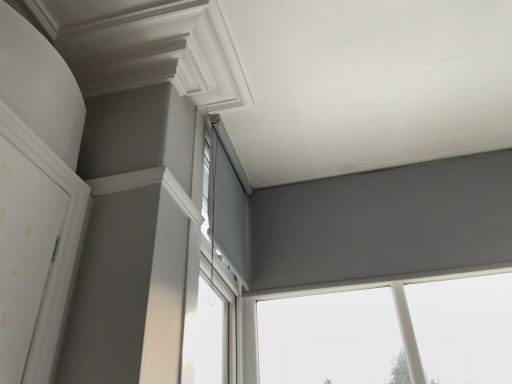
Question: Considering the relative positions of matte gray roller blind at center, acting as the 2th window starting from the right, and matte gray window at upper center, the third window positioned from the left, in the image provided, is matte gray roller blind at center, acting as the 2th window starting from the right, to the left of matte gray window at upper center, the third window positioned from the left, from the viewer's perspective?

Choices:
 (A) no
 (B) yes

Answer: (B)

Question: Is matte gray roller blind at center, acting as the 2th window starting from the right, wider than matte gray window at upper center, the third window positioned from the left?

Choices:
 (A) no
 (B) yes

Answer: (A)

Question: Is matte gray roller blind at center, the second window from the left, placed right next to matte gray window at upper center, placed as the first window when sorted from right to left?

Choices:
 (A) yes
 (B) no

Answer: (B)

Question: Is matte gray roller blind at center, acting as the 2th window starting from the right, bigger than matte gray window at upper center, placed as the first window when sorted from right to left?

Choices:
 (A) no
 (B) yes

Answer: (A)

Question: Does matte gray roller blind at center, the second window from the left, come behind matte gray window at upper center, the third window positioned from the left?

Choices:
 (A) no
 (B) yes

Answer: (A)

Question: Considering the relative sizes of matte gray roller blind at center, acting as the 2th window starting from the right, and matte gray window at upper center, the third window positioned from the left, in the image provided, is matte gray roller blind at center, acting as the 2th window starting from the right, shorter than matte gray window at upper center, the third window positioned from the left,?

Choices:
 (A) no
 (B) yes

Answer: (B)

Question: Can you confirm if matte gray window at upper center, placed as the first window when sorted from right to left, is shorter than matte gray roller blind at center, acting as the 2th window starting from the right?

Choices:
 (A) yes
 (B) no

Answer: (B)

Question: Is matte gray window at upper center, the third window positioned from the left, bigger than matte gray roller blind at center, the second window from the left?

Choices:
 (A) no
 (B) yes

Answer: (B)

Question: Is matte gray roller blind at center, the second window from the left, inside matte gray window at upper center, the third window positioned from the left?

Choices:
 (A) no
 (B) yes

Answer: (A)

Question: Is matte gray window at upper center, the third window positioned from the left, at the left side of matte gray roller blind at center, the second window from the left?

Choices:
 (A) yes
 (B) no

Answer: (B)

Question: Is matte gray window at upper center, placed as the first window when sorted from right to left, facing towards matte gray roller blind at center, the second window from the left?

Choices:
 (A) no
 (B) yes

Answer: (B)

Question: Is matte gray roller blind at center, acting as the 2th window starting from the right, at the back of matte gray window at upper center, placed as the first window when sorted from right to left?

Choices:
 (A) yes
 (B) no

Answer: (B)

Question: Is matte gray roller blind at center, the second window from the left, thinner than white plastic window at upper center, acting as the first window starting from the left?

Choices:
 (A) no
 (B) yes

Answer: (B)